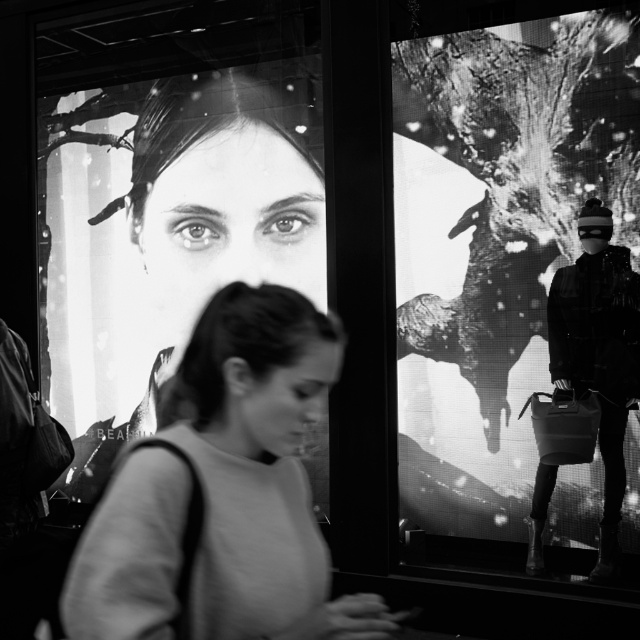
Question: Which point is closer to the camera?

Choices:
 (A) smooth skin face at center
 (B) smooth gray sweater at center

Answer: (B)

Question: Which is nearer to the smooth gray sweater at center?

Choices:
 (A) smooth skin face at center
 (B) black matte jacket at right

Answer: (B)

Question: Is smooth skin face at center positioned in front of black matte jacket at right?

Choices:
 (A) yes
 (B) no

Answer: (B)

Question: Is smooth gray sweater at center bigger than black matte jacket at right?

Choices:
 (A) no
 (B) yes

Answer: (B)

Question: Can you confirm if smooth gray sweater at center is positioned above black matte jacket at right?

Choices:
 (A) no
 (B) yes

Answer: (B)

Question: Which object is farther from the camera taking this photo?

Choices:
 (A) smooth skin face at center
 (B) smooth gray sweater at center

Answer: (A)